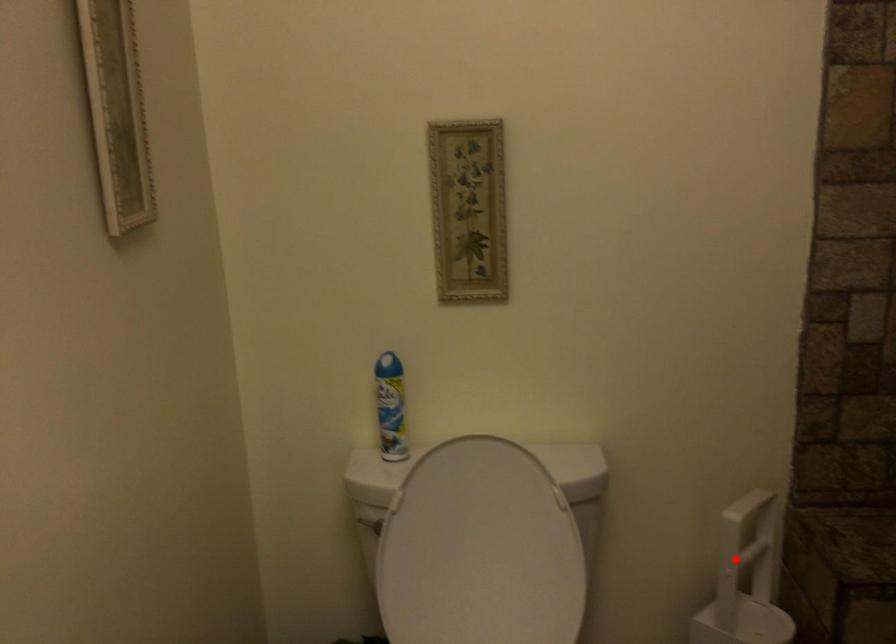
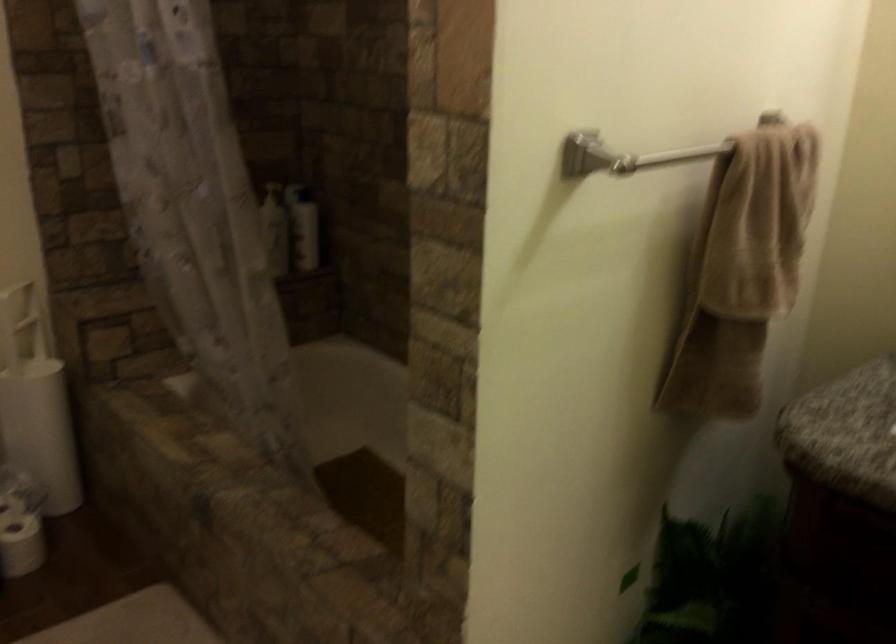
Find the pixel in the second image that matches the highlighted location in the first image.

(20, 323)